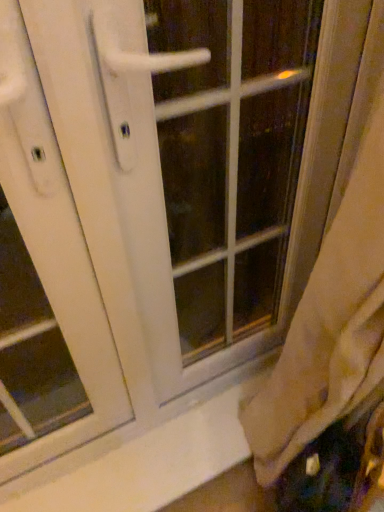
Where is `white smooth window sill at lower center`? The height and width of the screenshot is (512, 384). white smooth window sill at lower center is located at coordinates (140, 463).

The image size is (384, 512). I want to click on white smooth window sill at lower center, so click(x=140, y=463).

Which of these two, white glossy door handle at center or white smooth window sill at lower center, stands shorter?

Standing shorter between the two is white smooth window sill at lower center.

Find the location of a particular element. glass door above the white smooth window sill at lower center (from the image's perspective) is located at coordinates (231, 156).

Would you say white glossy door handle at center is outside white smooth window sill at lower center?

That's correct, white glossy door handle at center is outside of white smooth window sill at lower center.

Which object is more forward, white glossy door handle at center or white smooth window sill at lower center?

white glossy door handle at center.

Is white plastic screen door at left at the right side of white smooth window sill at lower center?

No, white plastic screen door at left is not to the right of white smooth window sill at lower center.

Which is behind, white plastic screen door at left or white smooth window sill at lower center?

white smooth window sill at lower center is further from the camera.

How different are the orientations of white plastic screen door at left and white smooth window sill at lower center in degrees?

There is a 0.0239-degree angle between the facing directions of white plastic screen door at left and white smooth window sill at lower center.

In terms of width, does white plastic screen door at left look wider or thinner when compared to white smooth window sill at lower center?

white plastic screen door at left is thinner than white smooth window sill at lower center.

Is white glossy door handle at center located within white smooth window sill at lower center?

Actually, white glossy door handle at center is outside white smooth window sill at lower center.

Considering the positions of points (10, 501) and (208, 307), is point (10, 501) farther from camera compared to point (208, 307)?

No, it is not.

Looking at their sizes, would you say white smooth window sill at lower center is wider or thinner than white glossy door handle at center?

Considering their sizes, white smooth window sill at lower center looks broader than white glossy door handle at center.

Which of these two, white smooth window sill at lower center or white glossy door handle at center, stands taller?

white glossy door handle at center.

Identify the location of screen door that is above the white smooth window sill at lower center (from a real-world perspective). (52, 246).

Is white smooth window sill at lower center turned away from white plastic screen door at left?

That's not correct — white smooth window sill at lower center is not looking away from white plastic screen door at left.

From the image's perspective, which one is positioned higher, white smooth window sill at lower center or white plastic screen door at left?

white plastic screen door at left, from the image's perspective.

Does white smooth window sill at lower center touch white plastic screen door at left?

white smooth window sill at lower center and white plastic screen door at left are not in contact.

Which is behind, white glossy door handle at center or white plastic screen door at left?

white glossy door handle at center is further away from the camera.

Can you confirm if white glossy door handle at center is positioned to the left of white plastic screen door at left?

No.

The width and height of the screenshot is (384, 512). Find the location of `glass door on the right of white plastic screen door at left`. glass door on the right of white plastic screen door at left is located at coordinates (231, 156).

From a real-world perspective, relative to white plastic screen door at left, is white glossy door handle at center vertically above or below?

white glossy door handle at center is below white plastic screen door at left.

Which is closer to the camera, (100, 406) or (243, 137)?

The point (100, 406) is closer.

Is white plastic screen door at left looking in the opposite direction of white glossy door handle at center?

No, white plastic screen door at left is not facing away from white glossy door handle at center.

In the image, is white plastic screen door at left on the left side or the right side of white glossy door handle at center?

Based on their positions, white plastic screen door at left is located to the left of white glossy door handle at center.

Find the location of `window sill behind the white glossy door handle at center`. window sill behind the white glossy door handle at center is located at coordinates (140, 463).

Where is `window sill below the white plastic screen door at left (from a real-world perspective)`? window sill below the white plastic screen door at left (from a real-world perspective) is located at coordinates (140, 463).

Which object lies further to the anchor point white plastic screen door at left, white smooth window sill at lower center or white glossy door handle at center?

Among the two, white glossy door handle at center is located further to white plastic screen door at left.

In the scene shown: Which object lies nearer to the anchor point white plastic screen door at left, white glossy door handle at center or white smooth window sill at lower center?

white smooth window sill at lower center lies closer to white plastic screen door at left than the other object.

Consider the image. From the image, which object appears to be nearer to white glossy door handle at center, white plastic screen door at left or white smooth window sill at lower center?

Based on the image, white smooth window sill at lower center appears to be nearer to white glossy door handle at center.

Based on the photo, which object lies nearer to the anchor point white smooth window sill at lower center, white glossy door handle at center or white plastic screen door at left?

white plastic screen door at left lies closer to white smooth window sill at lower center than the other object.

Based on their spatial positions, is white smooth window sill at lower center or white plastic screen door at left closer to white glossy door handle at center?

white smooth window sill at lower center is positioned closer to the anchor white glossy door handle at center.

From the image, which object appears to be nearer to white smooth window sill at lower center, white plastic screen door at left or white glossy door handle at center?

white plastic screen door at left lies closer to white smooth window sill at lower center than the other object.

The width and height of the screenshot is (384, 512). Identify the location of glass door between white plastic screen door at left and white smooth window sill at lower center from front to back. (231, 156).